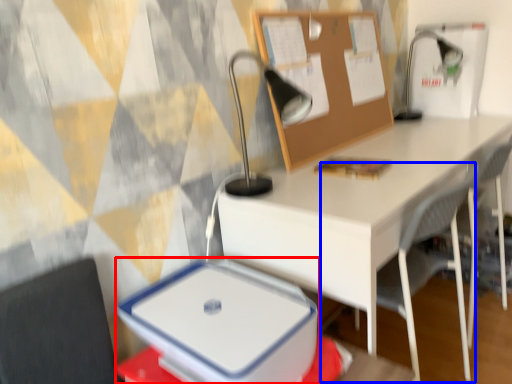
Question: Which point is closer to the camera, lunch box (highlighted by a red box) or armchair (highlighted by a blue box)?

Choices:
 (A) lunch box
 (B) armchair

Answer: (A)